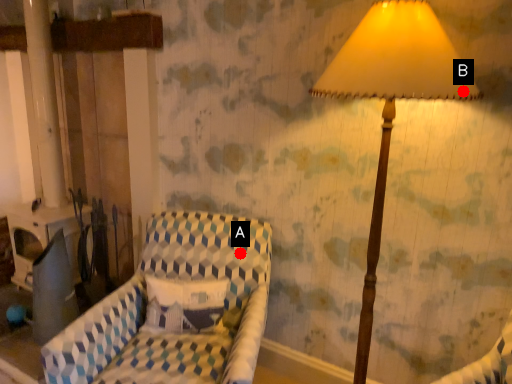
Question: Two points are circled on the image, labeled by A and B beside each circle. Which point is closer to the camera taking this photo?

Choices:
 (A) A is closer
 (B) B is closer

Answer: (B)